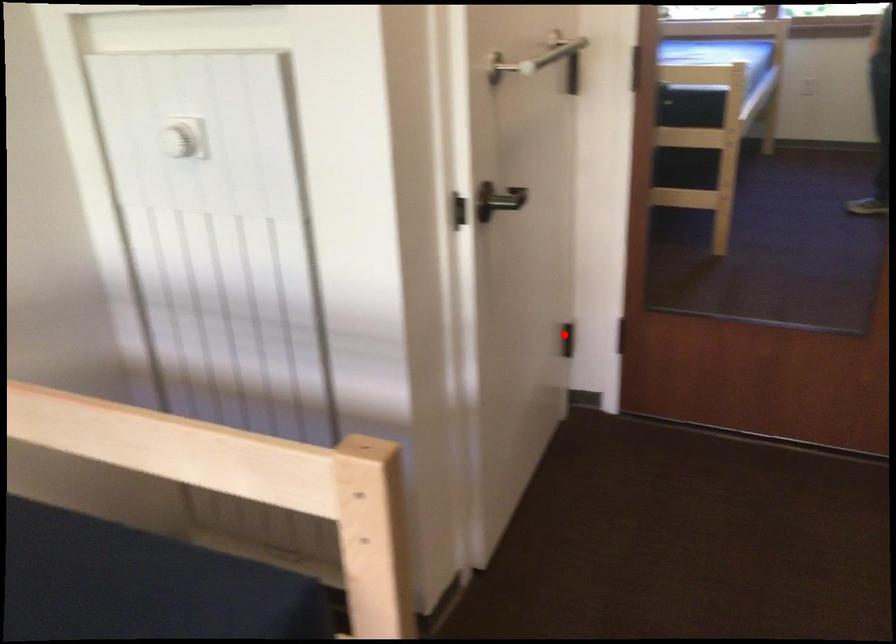
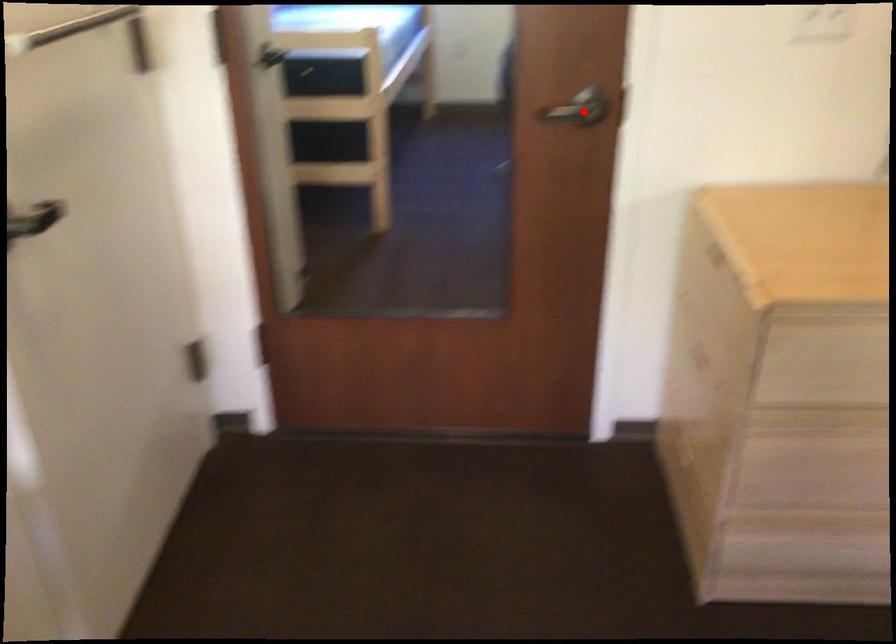
I am providing you with two images of the same scene from different viewpoints. A red point is marked on the first image and another point is marked on the second image. Do the highlighted points in image1 and image2 indicate the same real-world spot?

No